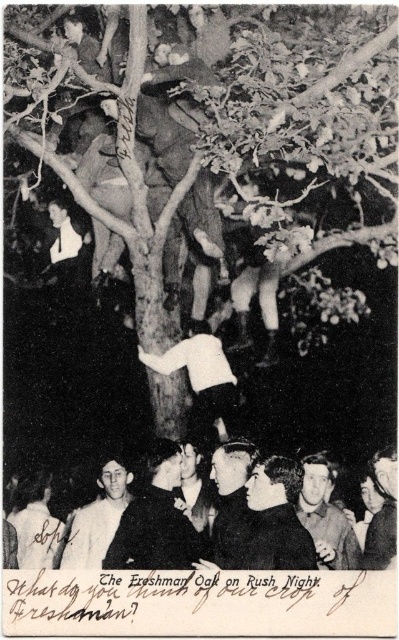
Question: Does dark clothing group at lower center appear under smooth leather jacket at lower right?

Choices:
 (A) no
 (B) yes

Answer: (A)

Question: Where is smooth black coat at center located in relation to smooth leather jacket at center in the image?

Choices:
 (A) right
 (B) left

Answer: (A)

Question: Based on their relative distances, which object is farther from the smooth black coat at center?

Choices:
 (A) rough bark tree at center
 (B) white matte shirt at center

Answer: (A)

Question: Which point is farther from the camera taking this photo?

Choices:
 (A) (327, 547)
 (B) (112, 552)
 (C) (231, 118)

Answer: (C)

Question: Is smooth black shirt at lower left further to the viewer compared to smooth leather jacket at center?

Choices:
 (A) no
 (B) yes

Answer: (A)

Question: Which of the following is the farthest from the observer?

Choices:
 (A) white matte shirt at center
 (B) dark clothing group at lower center
 (C) smooth leather jacket at lower right

Answer: (A)